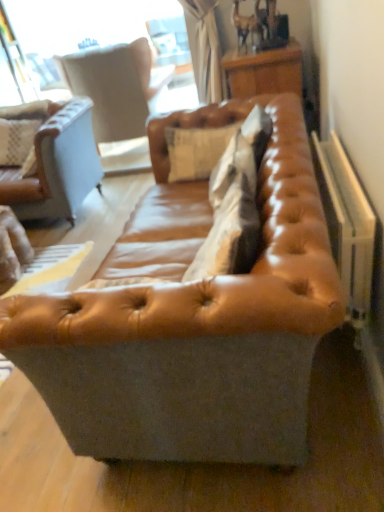
Image resolution: width=384 pixels, height=512 pixels. What do you see at coordinates (57, 167) in the screenshot? I see `brown leather couch at left, the second studio couch positioned from the right` at bounding box center [57, 167].

This screenshot has width=384, height=512. Describe the element at coordinates (264, 71) in the screenshot. I see `wooden table at upper right` at that location.

This screenshot has height=512, width=384. Find the location of `wooden table at upper right`. wooden table at upper right is located at coordinates (264, 71).

This screenshot has width=384, height=512. What do you see at coordinates (347, 224) in the screenshot?
I see `white plastic radiator at right` at bounding box center [347, 224].

Locate an element on the screen. white plastic radiator at right is located at coordinates (347, 224).

What is the approximate height of leather cushion at center?

13.55 inches.

At what (x,y) coordinates should I click in order to perform the action: click on brown leather couch at left, marked as the 1th studio couch in a left-to-right arrangement. Please return your answer as a coordinate pair (x, y). Looking at the image, I should click on (57, 167).

Can you confirm if wooden table at upper right is positioned to the right of brown leather couch at left, the second studio couch positioned from the right?

Indeed, wooden table at upper right is positioned on the right side of brown leather couch at left, the second studio couch positioned from the right.

Are wooden table at upper right and brown leather couch at left, marked as the 1th studio couch in a left-to-right arrangement, beside each other?

No, wooden table at upper right is not touching brown leather couch at left, marked as the 1th studio couch in a left-to-right arrangement.

Is wooden table at upper right positioned with its back to brown leather couch at left, the 2th studio couch from the front?

No, wooden table at upper right's orientation is not away from brown leather couch at left, the 2th studio couch from the front.

From a real-world perspective, is wooden table at upper right positioned above or below brown leather couch at left, the first studio couch viewed from the back?

wooden table at upper right is above brown leather couch at left, the first studio couch viewed from the back.

Choose the correct answer: Is white plastic radiator at right inside light beige leather swivel chair at upper left or outside it?

The correct answer is: outside.

From a real-world perspective, is white plastic radiator at right beneath light beige leather swivel chair at upper left?

Correct, in the physical world, white plastic radiator at right is lower than light beige leather swivel chair at upper left.

Is brown leather couch at left, the first studio couch viewed from the back, positioned far away from leather couch at center, the first studio couch positioned from the front?

Yes, brown leather couch at left, the first studio couch viewed from the back, is far from leather couch at center, the first studio couch positioned from the front.

Considering the sizes of objects brown leather couch at left, the 2th studio couch from the front, and leather couch at center, the 1th studio couch when ordered from right to left, in the image provided, who is smaller, brown leather couch at left, the 2th studio couch from the front, or leather couch at center, the 1th studio couch when ordered from right to left,?

With smaller size is brown leather couch at left, the 2th studio couch from the front.

Is brown leather couch at left, the second studio couch positioned from the right, further to camera compared to leather couch at center, the second studio couch from the back?

Yes, brown leather couch at left, the second studio couch positioned from the right, is behind leather couch at center, the second studio couch from the back.

From the image's perspective, which is below, leather cushion at center or brown leather couch at left, marked as the 1th studio couch in a left-to-right arrangement?

From the image's view, leather cushion at center is below.

Is leather cushion at center beside brown leather couch at left, the first studio couch viewed from the back?

leather cushion at center and brown leather couch at left, the first studio couch viewed from the back, are not in contact.

Looking at this image, from a real-world perspective, is leather cushion at center under brown leather couch at left, the 2th studio couch from the front?

Incorrect, from a real-world perspective, leather cushion at center is higher than brown leather couch at left, the 2th studio couch from the front.

Is leather cushion at center looking in the opposite direction of brown leather couch at left, the second studio couch positioned from the right?

No, leather cushion at center is not facing the opposite direction of brown leather couch at left, the second studio couch positioned from the right.

Would you consider leather couch at center, the second studio couch when ordered from left to right, to be distant from wooden table at upper right?

Yes, leather couch at center, the second studio couch when ordered from left to right, and wooden table at upper right are quite far apart.

Considering the positions of objects leather couch at center, the second studio couch when ordered from left to right, and wooden table at upper right in the image provided, who is more to the left, leather couch at center, the second studio couch when ordered from left to right, or wooden table at upper right?

Positioned to the left is leather couch at center, the second studio couch when ordered from left to right.

Is leather couch at center, the 1th studio couch when ordered from right to left, bigger than wooden table at upper right?

Yes, leather couch at center, the 1th studio couch when ordered from right to left, is bigger than wooden table at upper right.

How different are the orientations of leather couch at center, the 1th studio couch when ordered from right to left, and wooden table at upper right in degrees?

leather couch at center, the 1th studio couch when ordered from right to left, and wooden table at upper right are facing 0.751 degrees away from each other.

Considering the positions of points (292, 74) and (338, 164), is point (292, 74) closer to camera compared to point (338, 164)?

No, it is not.

From a real-world perspective, is wooden table at upper right above or below white plastic radiator at right?

wooden table at upper right is above white plastic radiator at right.

Considering the relative positions of wooden table at upper right and white plastic radiator at right in the image provided, is wooden table at upper right to the left or to the right of white plastic radiator at right?

From the image, it's evident that wooden table at upper right is to the left of white plastic radiator at right.

Measure the distance from leather cushion at center to leather couch at center, the second studio couch from the back.

leather cushion at center is 34.45 inches away from leather couch at center, the second studio couch from the back.

Who is bigger, leather cushion at center or leather couch at center, the second studio couch when ordered from left to right?

leather couch at center, the second studio couch when ordered from left to right.

Does leather cushion at center have a greater height compared to leather couch at center, the 1th studio couch when ordered from right to left?

In fact, leather cushion at center may be shorter than leather couch at center, the 1th studio couch when ordered from right to left.

Based on the photo, could you tell me if leather cushion at center is facing leather couch at center, the 1th studio couch when ordered from right to left?

Yes, leather cushion at center is facing leather couch at center, the 1th studio couch when ordered from right to left.

At what (x,y) coordinates should I click in order to perform the action: click on studio couch that is the 1st object located below the wooden table at upper right (from the image's perspective). Please return your answer as a coordinate pair (x, y). Looking at the image, I should click on (57, 167).

I want to click on radiator in front of the light beige leather swivel chair at upper left, so tap(347, 224).

In the scene shown: Looking at the image, which one is located closer to leather couch at center, the 1th studio couch when ordered from right to left, brown leather couch at left, marked as the 1th studio couch in a left-to-right arrangement, or white plastic radiator at right?

Among the two, white plastic radiator at right is located nearer to leather couch at center, the 1th studio couch when ordered from right to left.

Estimate the real-world distances between objects in this image. Which object is closer to wooden table at upper right, white plastic radiator at right or leather couch at center, the second studio couch when ordered from left to right?

white plastic radiator at right.

From the image, which object appears to be farther from leather cushion at center, white plastic radiator at right or wooden table at upper right?

white plastic radiator at right.

Based on their spatial positions, is brown leather couch at left, the 2th studio couch from the front, or light beige leather swivel chair at upper left closer to wooden table at upper right?

Based on the image, brown leather couch at left, the 2th studio couch from the front, appears to be nearer to wooden table at upper right.

Based on their spatial positions, is wooden table at upper right or light beige leather swivel chair at upper left closer to white plastic radiator at right?

wooden table at upper right lies closer to white plastic radiator at right than the other object.

Considering their positions, is light beige leather swivel chair at upper left positioned further to brown leather couch at left, the first studio couch viewed from the back, than wooden table at upper right?

wooden table at upper right is further to brown leather couch at left, the first studio couch viewed from the back.

Estimate the real-world distances between objects in this image. Which object is closer to white plastic radiator at right, leather couch at center, the 1th studio couch when ordered from right to left, or wooden table at upper right?

leather couch at center, the 1th studio couch when ordered from right to left, is closer to white plastic radiator at right.

Based on their spatial positions, is brown leather couch at left, the first studio couch viewed from the back, or white plastic radiator at right closer to wooden table at upper right?

white plastic radiator at right.

Where is `table between brown leather couch at left, the 2th studio couch from the front, and white plastic radiator at right from left to right`? The width and height of the screenshot is (384, 512). table between brown leather couch at left, the 2th studio couch from the front, and white plastic radiator at right from left to right is located at coordinates (264, 71).

Locate an element on the screen. pillow between white plastic radiator at right and light beige leather swivel chair at upper left in the front-back direction is located at coordinates (196, 150).

Where is `radiator between leather couch at center, the second studio couch when ordered from left to right, and light beige leather swivel chair at upper left from front to back`? radiator between leather couch at center, the second studio couch when ordered from left to right, and light beige leather swivel chair at upper left from front to back is located at coordinates (347, 224).

I want to click on table positioned between leather cushion at center and light beige leather swivel chair at upper left from near to far, so click(264, 71).